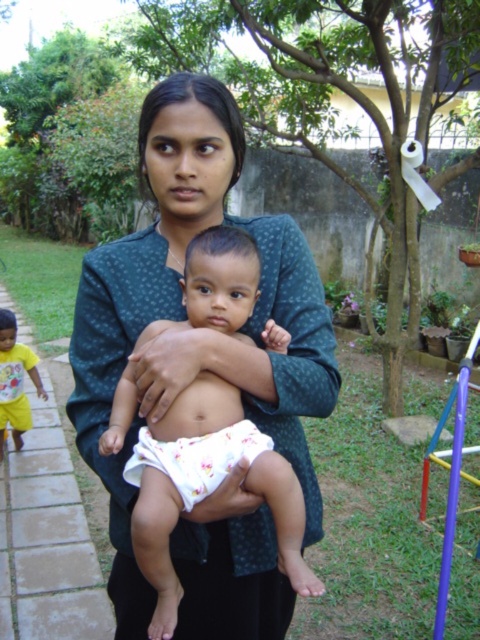
You are standing in the garden and want to place a small flower pot between the two points labeled point (253, 448) and point (12, 337). Which point should the flower pot be closer to if you want it to be nearer to the viewer?

The flower pot should be placed closer to point (253, 448) because it is closer to the viewer than point (12, 337).

You are a photographer trying to capture a closeup of the floral cotton diaper at center and the yellow cotton shirt at left. Which object should you focus on first if you want to ensure both are in focus?

The yellow cotton shirt at left should be focused on first because it is closer to the camera than the floral cotton diaper at center, which is positioned further away.